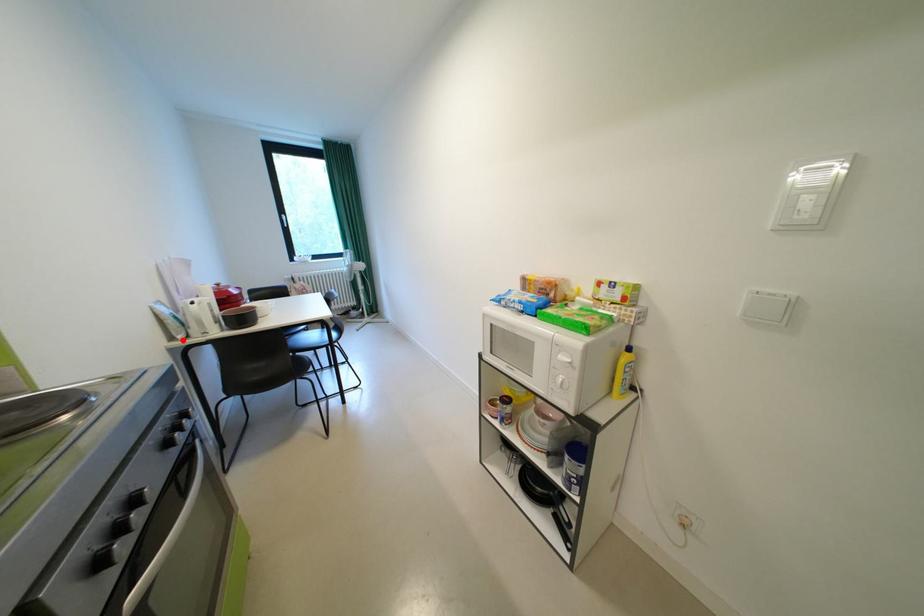
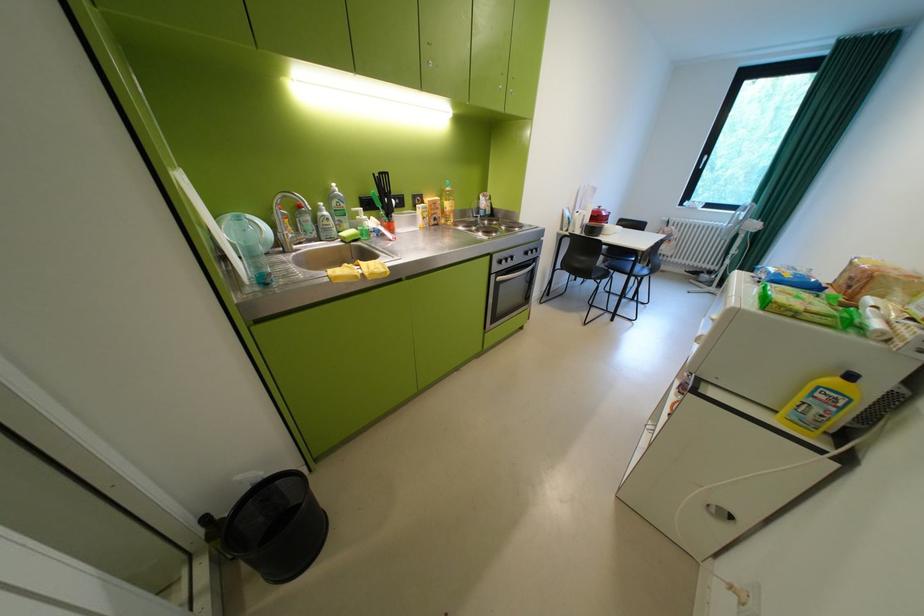
Find the pixel in the second image that matches the highlighted location in the first image.

(572, 230)